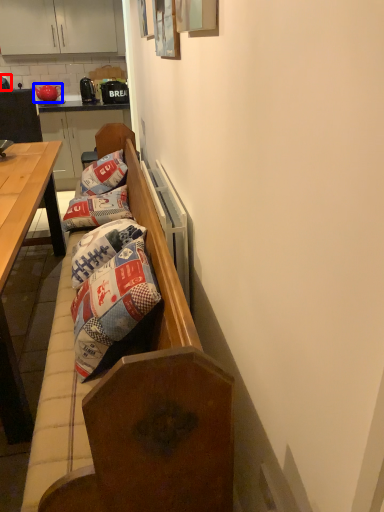
Question: Among these objects, which one is farthest to the camera, coffee cup (highlighted by a red box) or teapot (highlighted by a blue box)?

Choices:
 (A) coffee cup
 (B) teapot

Answer: (B)